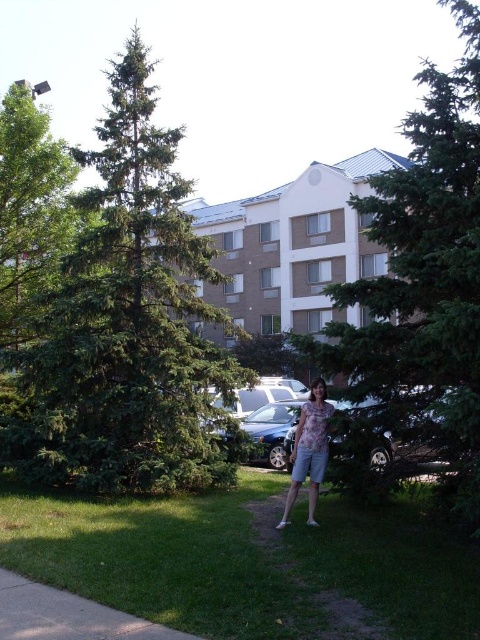
Question: Is green needle-like at left smaller than green leafy tree at upper left?

Choices:
 (A) no
 (B) yes

Answer: (A)

Question: Is green needle-like at left bigger than green leafy tree at upper left?

Choices:
 (A) no
 (B) yes

Answer: (B)

Question: Estimate the real-world distances between objects in this image. Which object is closer to the green grass at lower center?

Choices:
 (A) green needle-like tree at center
 (B) green leafy tree at upper left
 (C) green needle-like at left

Answer: (A)

Question: Which object appears closest to the camera in this image?

Choices:
 (A) green grass at lower center
 (B) gray concrete sidewalk at lower left
 (C) green needle-like tree at center

Answer: (B)

Question: Which of the following is the closest to the observer?

Choices:
 (A) floral fabric dress at center
 (B) green leafy tree at upper left
 (C) green needle-like tree at center
 (D) gray concrete sidewalk at lower left

Answer: (D)

Question: Does green grass at lower center appear on the left side of green leafy tree at upper left?

Choices:
 (A) no
 (B) yes

Answer: (A)